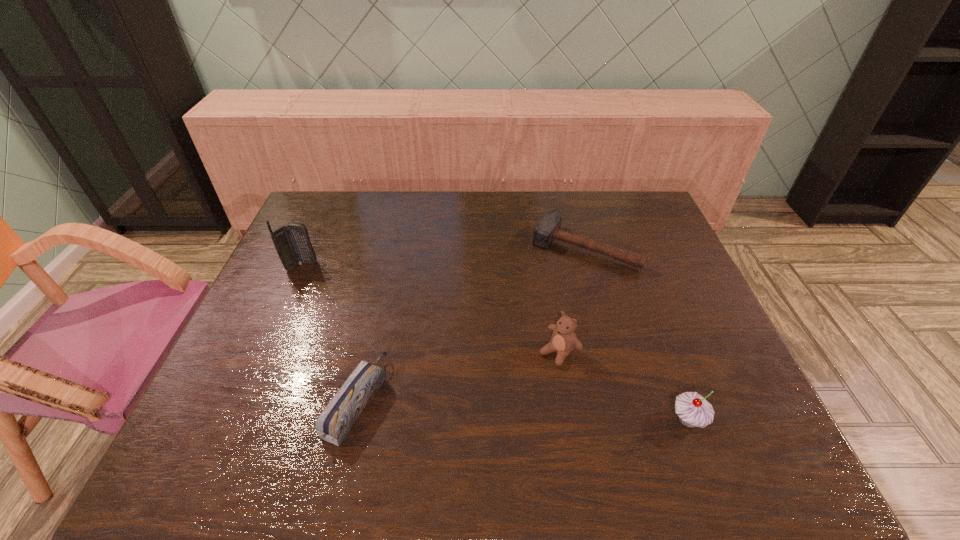
Locate an element on the screen. This screenshot has height=540, width=960. vacant spot on the desktop that is between the pencil box and the cupcake and is positioned on the striking surface of the shortest object is located at coordinates (484, 408).

Identify the location of free space on the desktop that is between the fourth object from right to left and the cupcake and is positioned on the front-facing side of the teddy bear. (498, 408).

Locate an element on the screen. free space on the desktop that is between the second object from left to right and the cupcake and is positioned on the keyboard of the cellular telephone is located at coordinates (550, 411).